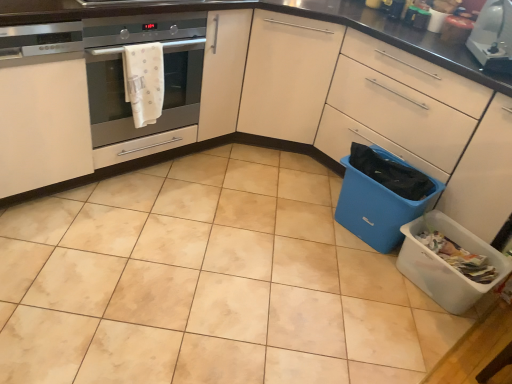
The width and height of the screenshot is (512, 384). In order to click on vacant space situated on the left part of white plastic recycling bin at lower right, which is the 1th recycling bin in bottom-to-top order in this screenshot , I will do `click(359, 280)`.